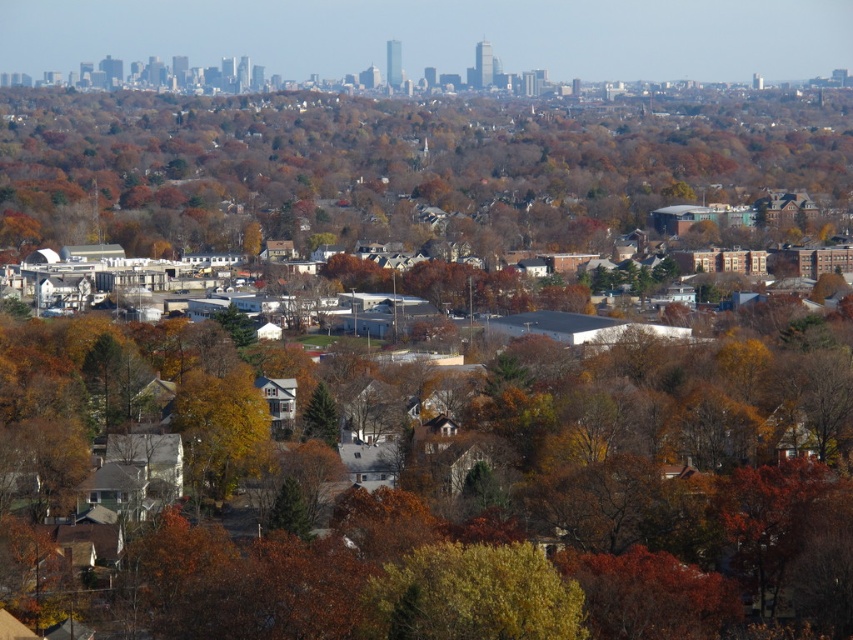
Question: Based on their relative distances, which object is nearer to the brown matte tree at center?

Choices:
 (A) yellow-green leafy tree at center
 (B) green matte tree at center

Answer: (B)

Question: Among these points, which one is farthest from the camera?

Choices:
 (A) (206, 401)
 (B) (306, 436)
 (C) (456, 561)
 (D) (193, 122)

Answer: (D)

Question: Can you confirm if yellow matte tree at center is wider than green matte tree at center?

Choices:
 (A) yes
 (B) no

Answer: (A)

Question: Which of these objects is positioned farthest from the green matte tree at center?

Choices:
 (A) brown matte tree at center
 (B) yellow matte tree at center
 (C) yellow-green leafy tree at center

Answer: (A)

Question: Can you confirm if yellow-green leafy tree at center is positioned to the right of yellow matte tree at center?

Choices:
 (A) no
 (B) yes

Answer: (B)

Question: Observing the image, what is the correct spatial positioning of yellow-green leafy tree at center in reference to green matte tree at center?

Choices:
 (A) left
 (B) right

Answer: (B)